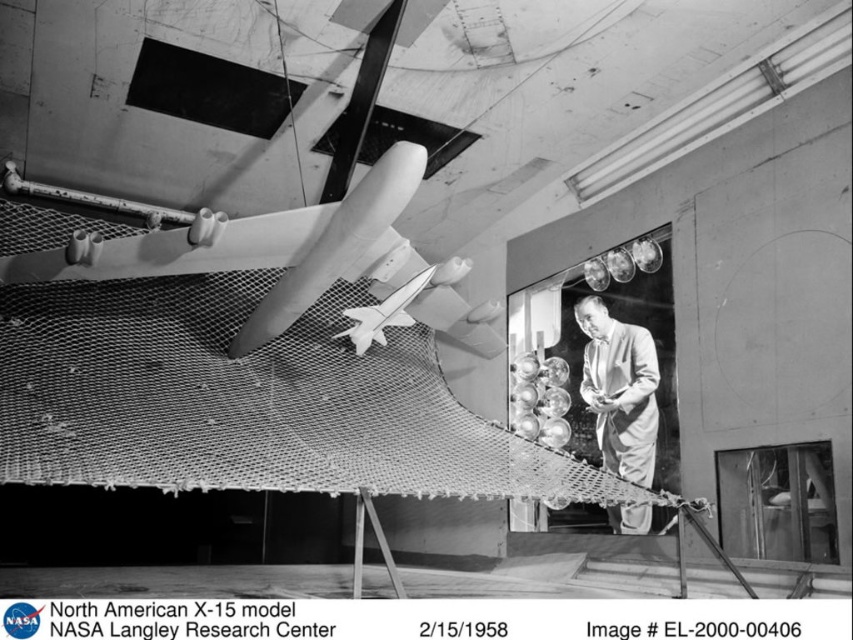
Does smooth white airplane at center have a lesser width compared to light gray suit at center?

No, smooth white airplane at center is not thinner than light gray suit at center.

Does point (225, 257) come closer to viewer compared to point (607, 388)?

Yes, it is in front of point (607, 388).

Image resolution: width=853 pixels, height=640 pixels. Identify the location of smooth white airplane at center. 285,257.

The width and height of the screenshot is (853, 640). What are the coordinates of `smooth white airplane at center` in the screenshot? It's located at (285, 257).